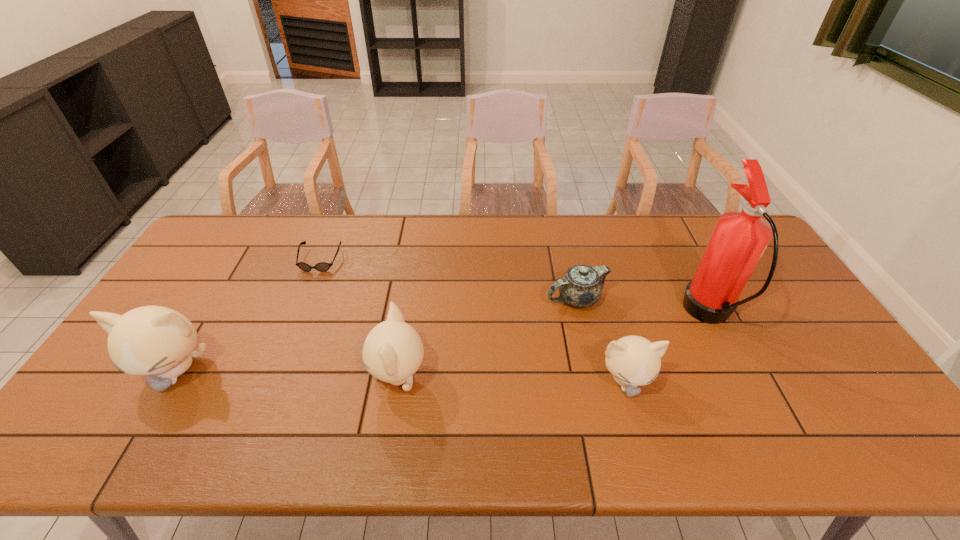
Where is `free region that satisfies the following two spatial constraints: 1. from the spout of the chinaware; 2. on the face of the leftmost object`? This screenshot has height=540, width=960. free region that satisfies the following two spatial constraints: 1. from the spout of the chinaware; 2. on the face of the leftmost object is located at coordinates (592, 370).

This screenshot has width=960, height=540. What are the coordinates of `vacant point that satisfies the following two spatial constraints: 1. from the spout of the second shortest object; 2. on the face of the leftmost object` in the screenshot? It's located at [x=592, y=370].